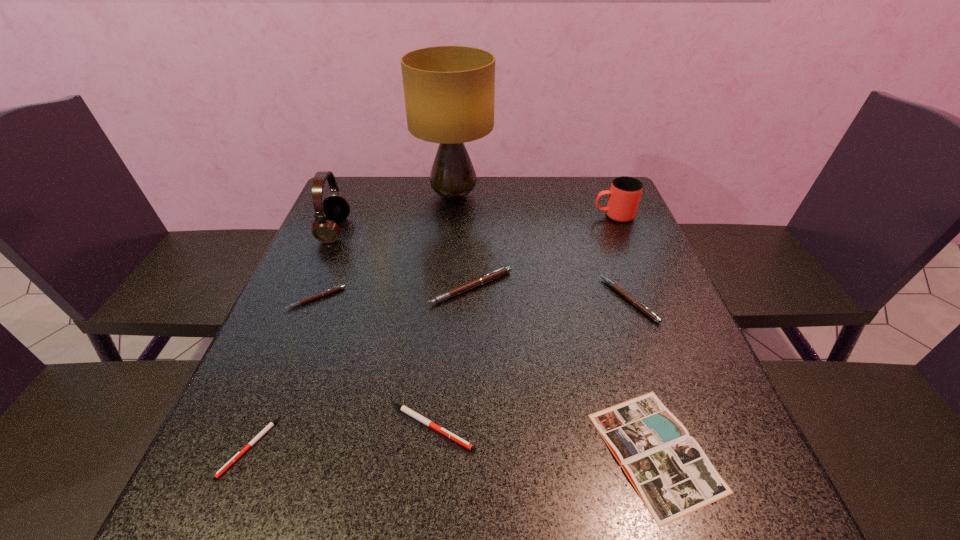
This screenshot has width=960, height=540. I want to click on free region located at the nib of the tallest pen, so click(469, 352).

Where is `vacant space situated at the nib of the second tallest pen`? This screenshot has height=540, width=960. vacant space situated at the nib of the second tallest pen is located at coordinates (559, 300).

The height and width of the screenshot is (540, 960). I want to click on free location located 0.270m at the nib of the second tallest pen, so click(x=489, y=300).

Where is `free space located at the nib of the second tallest pen`? The width and height of the screenshot is (960, 540). free space located at the nib of the second tallest pen is located at coordinates (571, 300).

Where is `free space located 0.340m at the nib of the leftmost pink pen`? This screenshot has height=540, width=960. free space located 0.340m at the nib of the leftmost pink pen is located at coordinates (x=252, y=456).

You are a GUI agent. You are given a task and a screenshot of the screen. Output one action in this format:
    pyautogui.click(x=<x>, y=<y>)
    Task: Click on the vacant space situated on the clicker of the bigger white pen
    Image resolution: width=960 pixels, height=540 pixels.
    Given the screenshot: What is the action you would take?
    pyautogui.click(x=699, y=427)

Where is `blank space located on the back of the book`? blank space located on the back of the book is located at coordinates (607, 296).

At what (x,y) coordinates should I click in order to perform the action: click on lampshade that is at the far edge. Please return your answer as a coordinate pair (x, y). The image size is (960, 540). Looking at the image, I should click on (449, 91).

I want to click on headset that is at the far edge, so click(x=336, y=208).

Find the location of a particular element. The image size is (960, 540). cup that is positioned at the far edge is located at coordinates (624, 195).